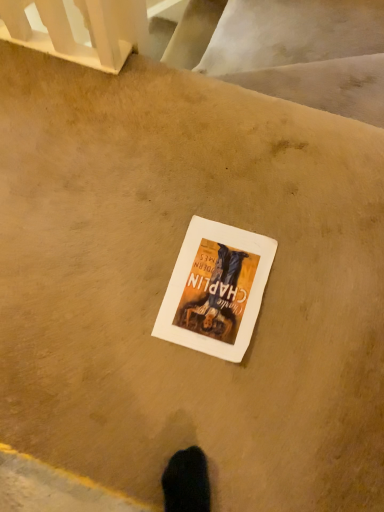
The image size is (384, 512). Find the location of `free space that is to the left of white paper at center`. free space that is to the left of white paper at center is located at coordinates point(116,279).